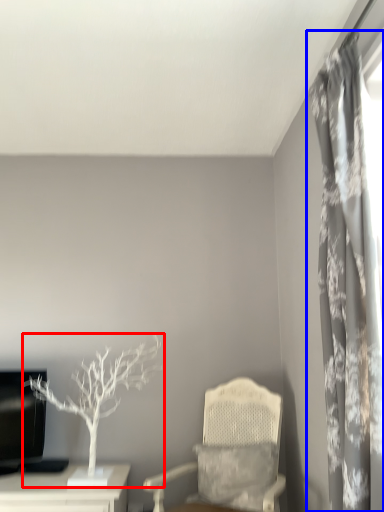
Question: Which point is closer to the camera, houseplant (highlighted by a red box) or curtain (highlighted by a blue box)?

Choices:
 (A) houseplant
 (B) curtain

Answer: (B)